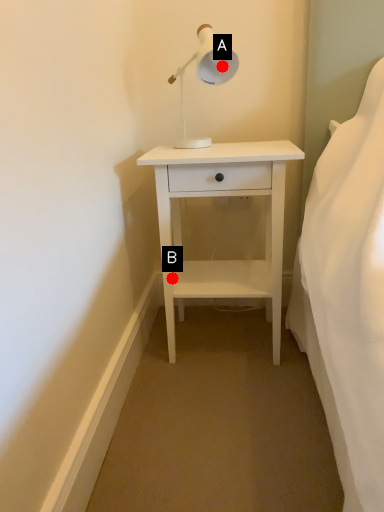
Question: Two points are circled on the image, labeled by A and B beside each circle. Which point appears farthest from the camera in this image?

Choices:
 (A) A is further
 (B) B is further

Answer: (B)